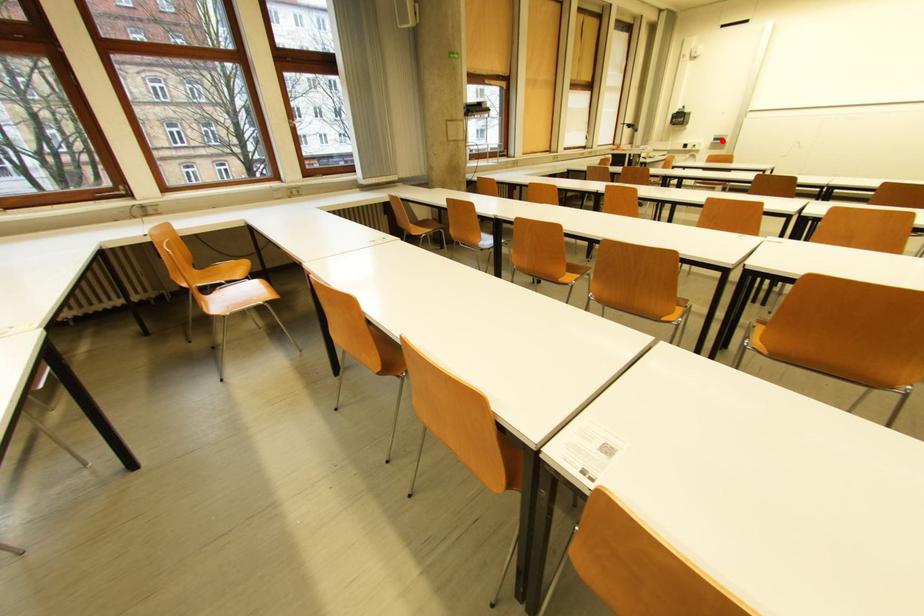
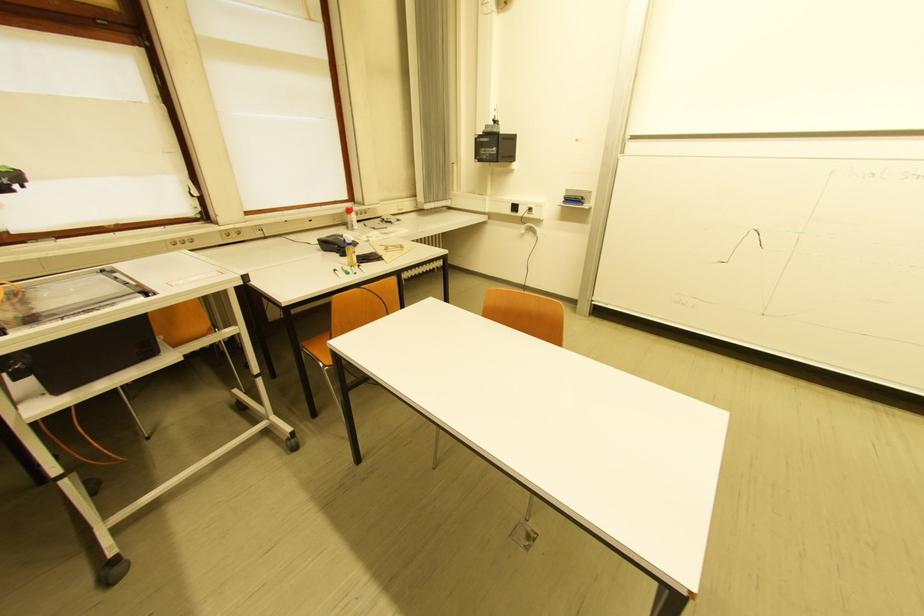
The point at the highlighted location is marked in the first image. Where is the corresponding point in the second image?

(575, 201)